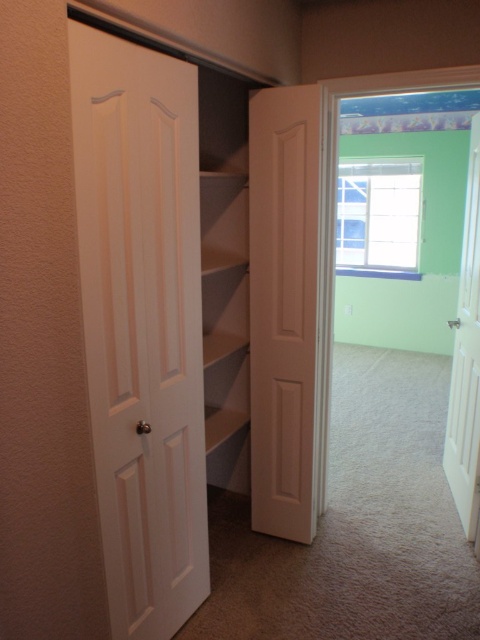
Question: Estimate the real-world distances between objects in this image. Which object is closer to the white matte door at center?

Choices:
 (A) white matte door at left
 (B) white wooden door at right

Answer: (A)

Question: Is white matte door at left to the right of white wooden door at right from the viewer's perspective?

Choices:
 (A) yes
 (B) no

Answer: (B)

Question: Which of the following is the closest to the observer?

Choices:
 (A) (464, 387)
 (B) (159, 328)

Answer: (B)

Question: Can you confirm if white matte door at center is positioned to the left of white wooden door at right?

Choices:
 (A) yes
 (B) no

Answer: (A)

Question: Among these points, which one is farthest from the camera?

Choices:
 (A) (80, 266)
 (B) (300, 100)
 (C) (475, 428)

Answer: (C)

Question: Can you confirm if white matte door at center is positioned to the right of white wooden door at right?

Choices:
 (A) yes
 (B) no

Answer: (B)